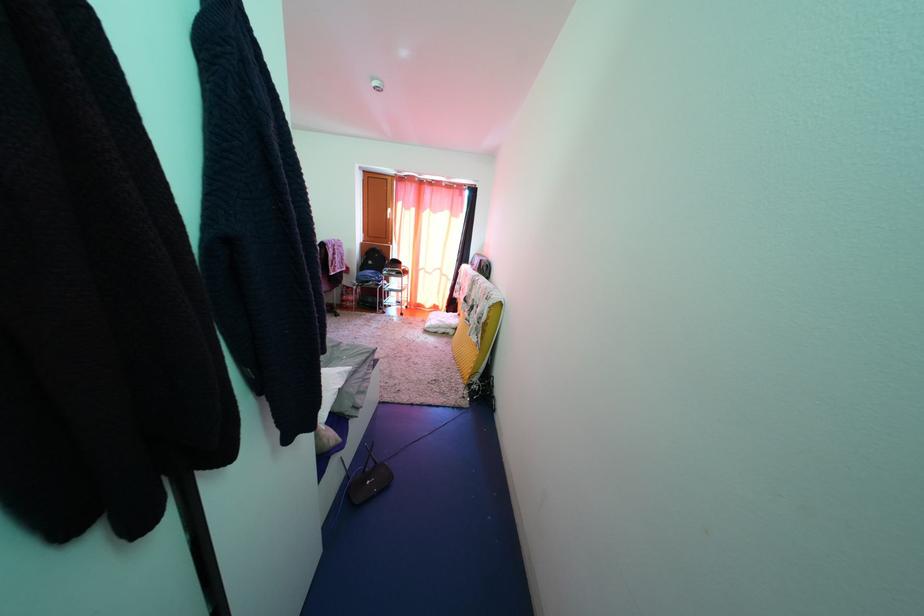
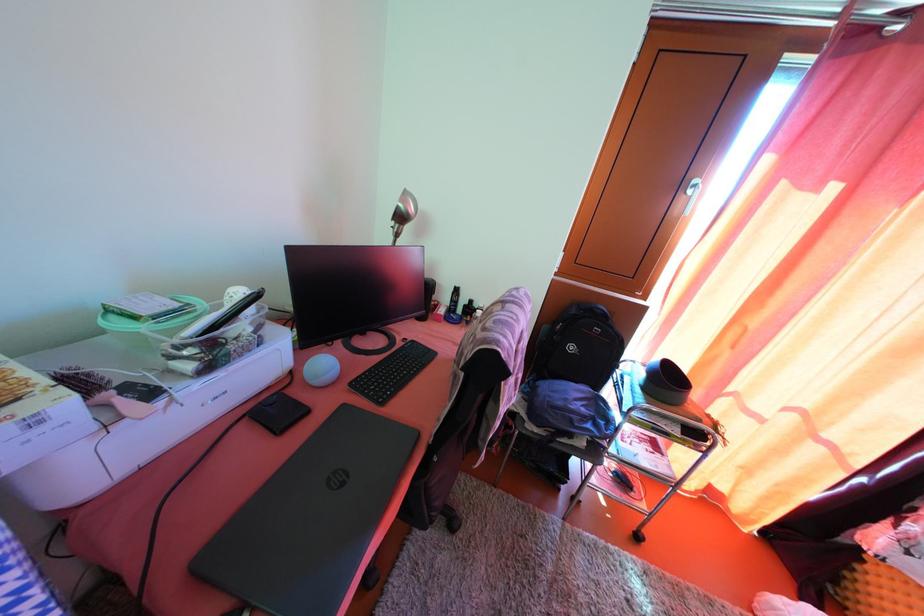
In a continuous first-person perspective shot, in which direction is the camera moving?

The cameraman walked toward left, forward.